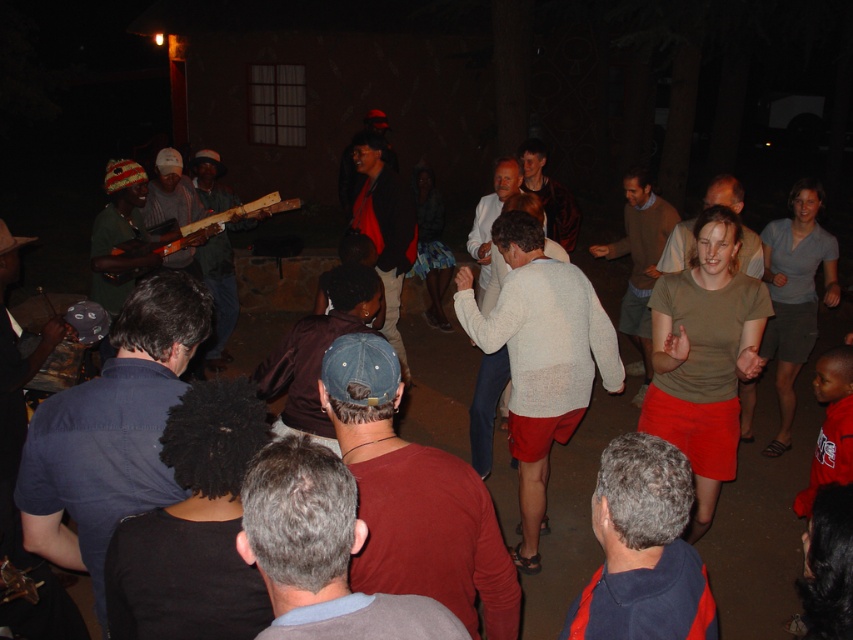
Question: Can you confirm if dark red sweater at center is wider than matte wooden guitar at center-left?

Choices:
 (A) no
 (B) yes

Answer: (A)

Question: Which object appears closest to the camera in this image?

Choices:
 (A) gray hair at center
 (B) matte black jacket at center

Answer: (A)

Question: Can you confirm if matte brown sweater at center is positioned to the right of matte wooden guitar at center-left?

Choices:
 (A) yes
 (B) no

Answer: (A)

Question: Considering the relative positions of gray fabric shirt at center and matte brown shirt at center in the image provided, where is gray fabric shirt at center located with respect to matte brown shirt at center?

Choices:
 (A) above
 (B) below

Answer: (B)

Question: Which object is closer to the camera taking this photo?

Choices:
 (A) light gray sweater at center
 (B) matte brown shirt at center
 (C) matte wooden guitar at center-left
 (D) blue denim shirt at lower left

Answer: (D)

Question: Which point appears farthest from the camera in this image?

Choices:
 (A) (502, 396)
 (B) (227, 323)
 (C) (329, 400)

Answer: (B)